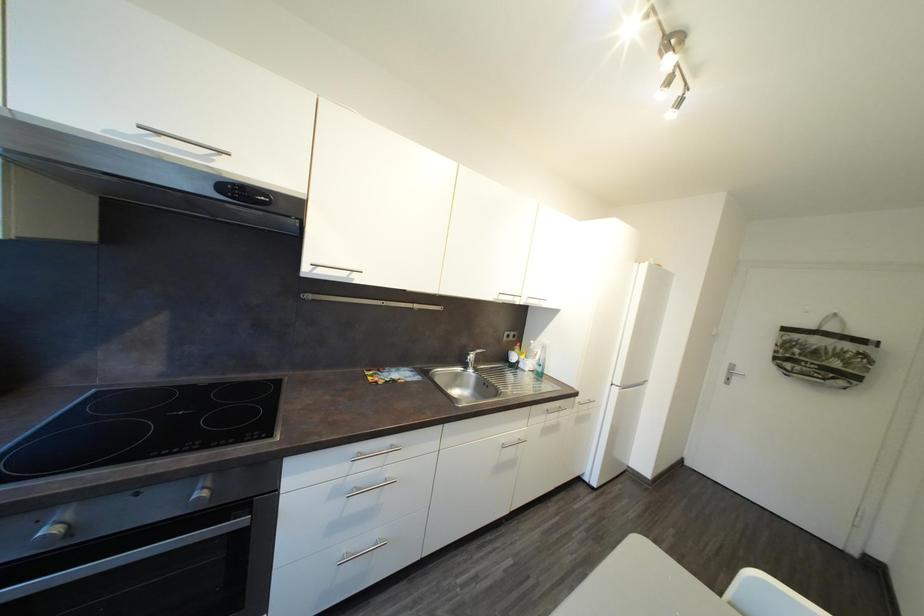
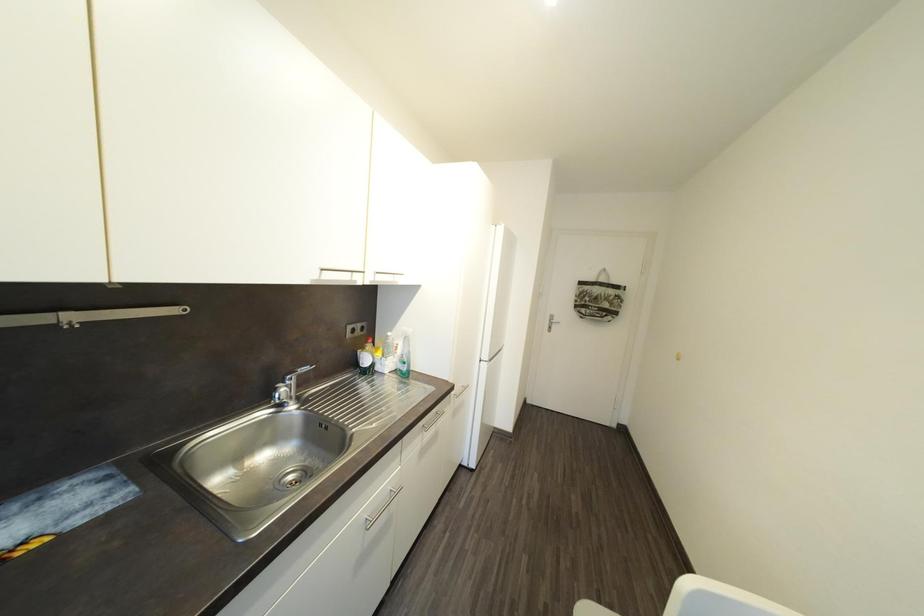
Question: The camera is either moving clockwise (left) or counter-clockwise (right) around the object. The first image is from the beginning of the video and the second image is from the end. Is the camera moving left or right when shooting the video?

Choices:
 (A) Left
 (B) Right

Answer: (A)